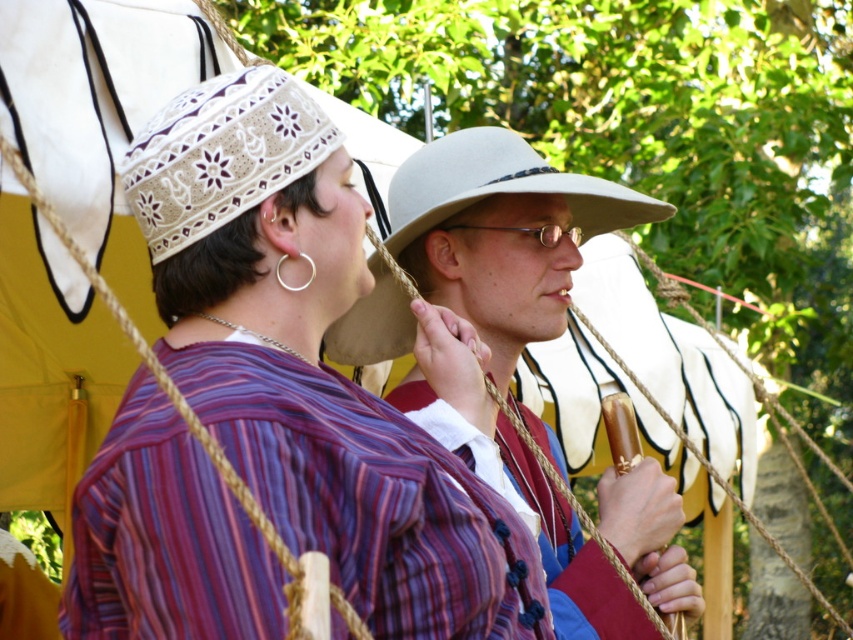
Question: Can you confirm if matte striped shirt at center is thinner than white lace cowboy hat at upper center?

Choices:
 (A) yes
 (B) no

Answer: (B)

Question: Among these objects, which one is farthest from the camera?

Choices:
 (A) beige felt cowboy hat at center
 (B) white lace cowboy hat at upper center
 (C) matte white hat at center

Answer: (A)

Question: Which of these objects is positioned closest to the white lace cowboy hat at upper center?

Choices:
 (A) matte striped shirt at center
 (B) beige felt cowboy hat at center
 (C) matte white hat at center

Answer: (A)

Question: Can you confirm if matte striped shirt at center is positioned to the right of matte white hat at center?

Choices:
 (A) no
 (B) yes

Answer: (A)

Question: Which point is farther from the camera taking this photo?

Choices:
 (A) (605, 636)
 (B) (505, 170)

Answer: (B)

Question: Does matte white hat at center have a larger size compared to white lace cowboy hat at upper center?

Choices:
 (A) no
 (B) yes

Answer: (B)